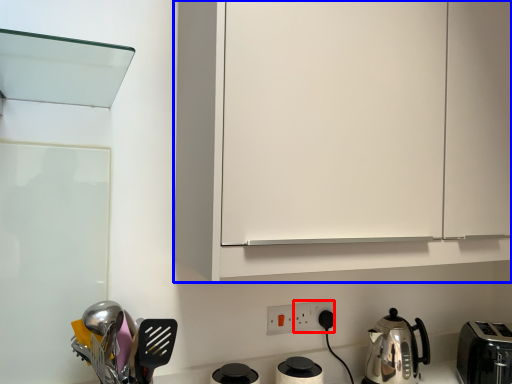
Question: Which object appears farthest to the camera in this image, electric outlet (highlighted by a red box) or cabinetry (highlighted by a blue box)?

Choices:
 (A) electric outlet
 (B) cabinetry

Answer: (A)